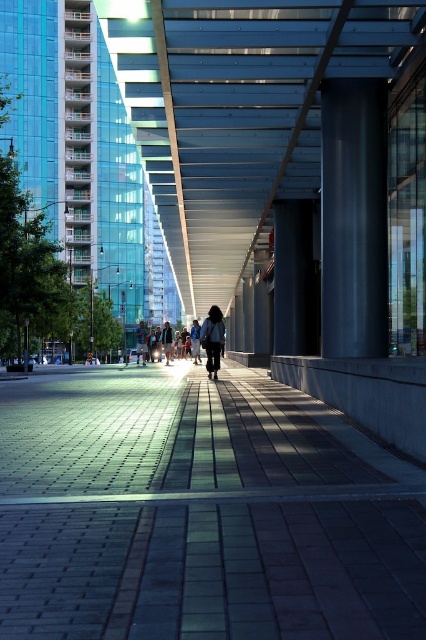
Question: Can you confirm if brick paved sidewalk at center is thinner than light brown leather jacket at center?

Choices:
 (A) yes
 (B) no

Answer: (A)

Question: Is dark gray fabric coat at center bigger than dark gray jacket at center?

Choices:
 (A) yes
 (B) no

Answer: (B)

Question: Which object is the closest to the dark gray fabric coat at center?

Choices:
 (A) light brown leather jacket at center
 (B) black glossy pillar at center
 (C) dark gray jacket at center

Answer: (B)

Question: Among these objects, which one is nearest to the camera?

Choices:
 (A) black glossy pillar at center
 (B) brick paved sidewalk at center
 (C) black smooth pillar at center
 (D) dark gray fabric coat at center

Answer: (B)

Question: Where is brick paved sidewalk at center located in relation to black glossy pillar at center in the image?

Choices:
 (A) above
 (B) below

Answer: (B)

Question: Which of the following is the closest to the observer?

Choices:
 (A) black smooth pillar at center
 (B) light brown leather jacket at center
 (C) brick paved sidewalk at center
 (D) dark gray fabric coat at center

Answer: (C)